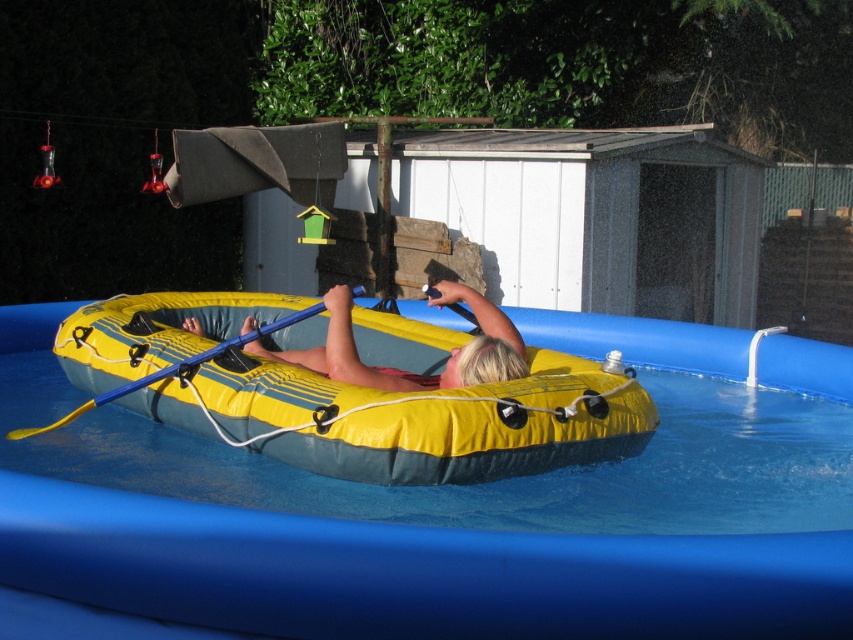
From the picture: You are a photographer trying to capture a clear shot of the yellow rubber kayak at center and the blonde hair at upper center. Which object should you focus on first if you want to ensure both are in focus without adjusting the camera settings?

The yellow rubber kayak at center is much taller than the blonde hair at upper center, so focusing on the taller object first would help ensure both are in focus.